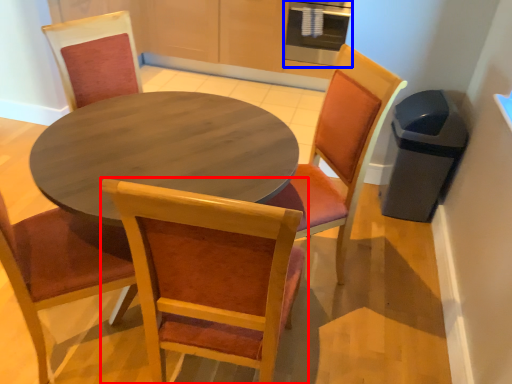
Question: Which object appears farthest to the camera in this image, chair (highlighted by a red box) or appliance (highlighted by a blue box)?

Choices:
 (A) chair
 (B) appliance

Answer: (B)